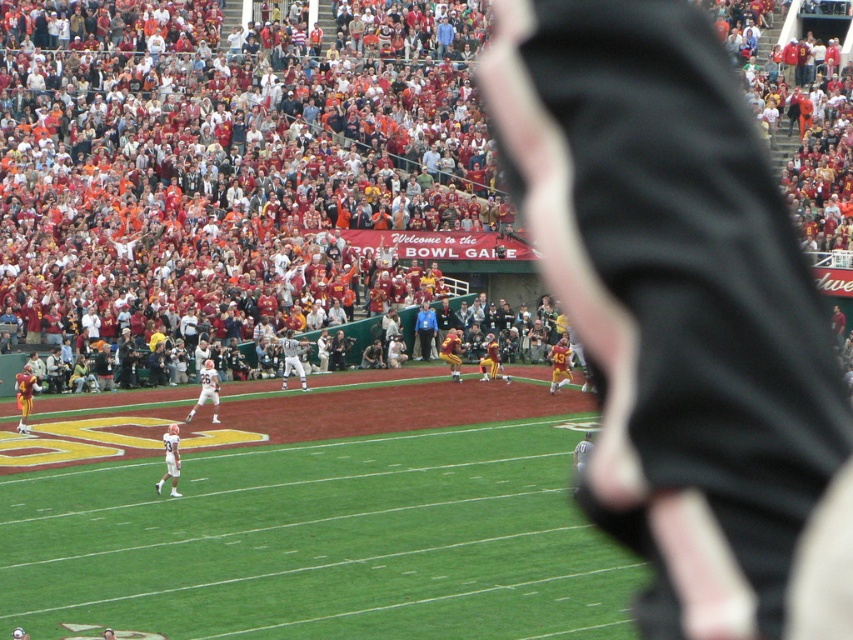
Between red fabric crowd at upper center and green grass football field at center, which one appears on the right side from the viewer's perspective?

green grass football field at center is more to the right.

Who is more forward, (148, 202) or (393, 385)?

Point (393, 385)

Where is `red fabric crowd at upper center`? red fabric crowd at upper center is located at coordinates (235, 184).

Can you confirm if red fabric crowd at upper center is shorter than white matte jersey at center?

No, red fabric crowd at upper center is not shorter than white matte jersey at center.

Who is positioned more to the left, red fabric crowd at upper center or white matte jersey at center?

white matte jersey at center is more to the left.

Is point (3, 298) closer to camera compared to point (161, 481)?

No, (3, 298) is behind (161, 481).

Identify the location of red fabric crowd at upper center. (235, 184).

Identify the location of white matte jersey at center. Image resolution: width=853 pixels, height=640 pixels. (170, 460).